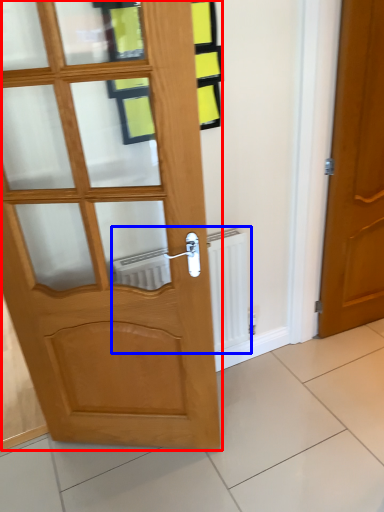
Question: Which of the following is the farthest to the observer, door (highlighted by a red box) or radiator (highlighted by a blue box)?

Choices:
 (A) door
 (B) radiator

Answer: (B)